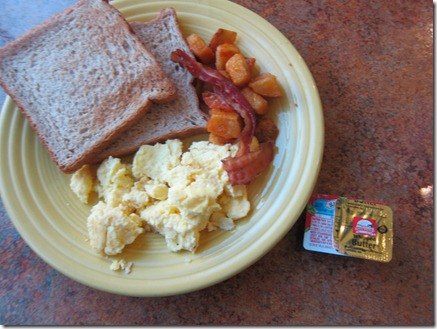
The image size is (437, 329). I want to click on yellow plate, so click(69, 241).